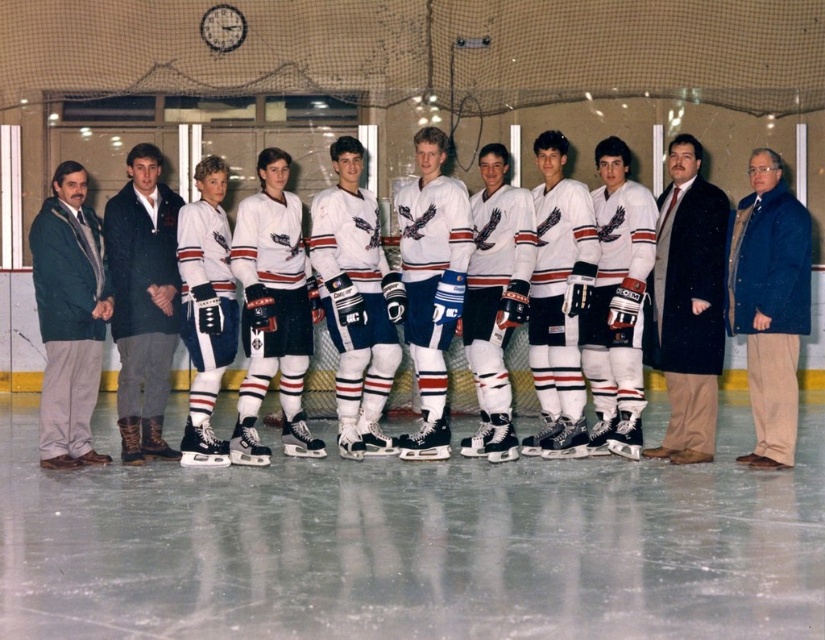
Question: In this image, where is dark blue corduroy pants at center located relative to green wool jacket at left?

Choices:
 (A) below
 (B) above

Answer: (B)

Question: Which object is the farthest from the dark blue wool coat at right?

Choices:
 (A) white ice at center
 (B) dark blue corduroy pants at center

Answer: (B)

Question: Which point appears closest to the camera in this image?

Choices:
 (A) (130, 189)
 (B) (60, 429)
 (C) (583, 566)

Answer: (C)

Question: Among these objects, which one is nearest to the camera?

Choices:
 (A) blue textured coat at right
 (B) white jersey at center
 (C) white ice at center
 (D) green wool jacket at left

Answer: (C)

Question: Considering the relative positions of white ice at center and blue textured coat at right in the image provided, where is white ice at center located with respect to blue textured coat at right?

Choices:
 (A) above
 (B) below

Answer: (B)

Question: Is dark blue corduroy pants at center below white jersey at center?

Choices:
 (A) yes
 (B) no

Answer: (A)